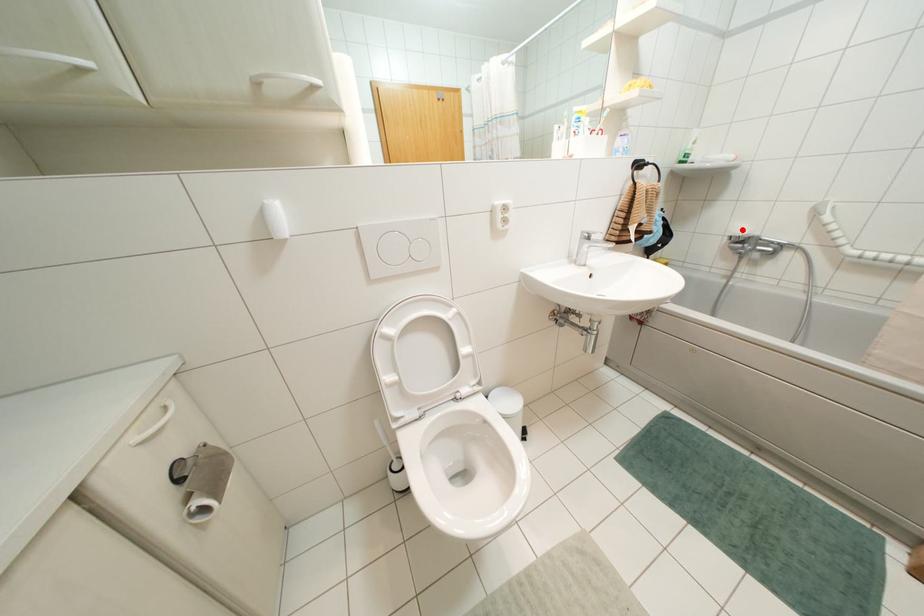
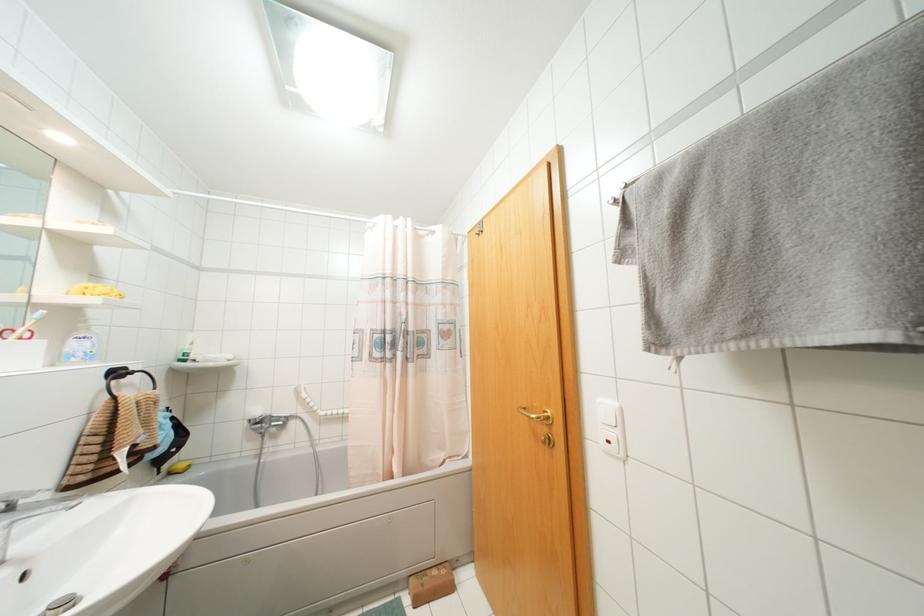
Question: I am providing you with two images of the same scene from different viewpoints. A red point is marked on the first image. Is the red point's position out of view in image 2?

Choices:
 (A) Yes
 (B) No

Answer: (B)